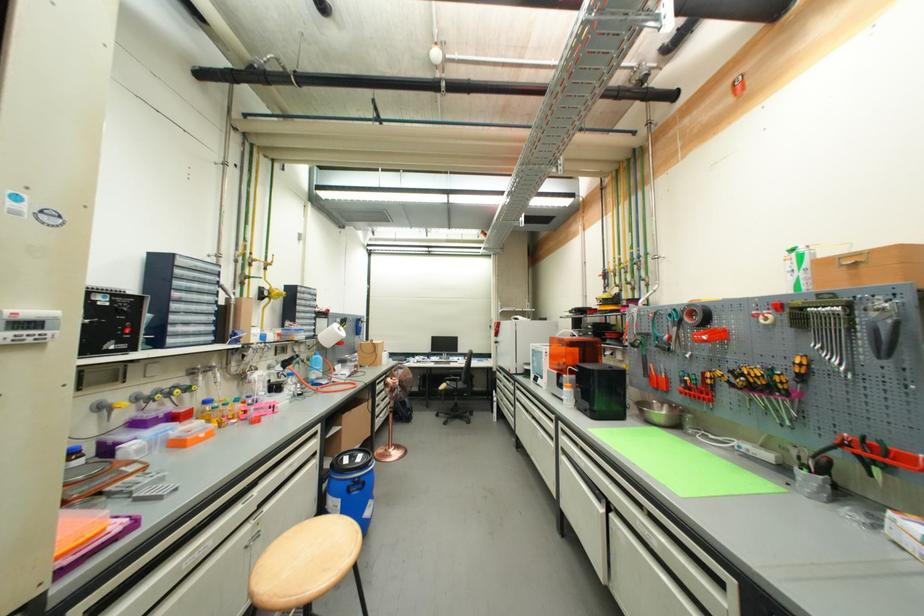
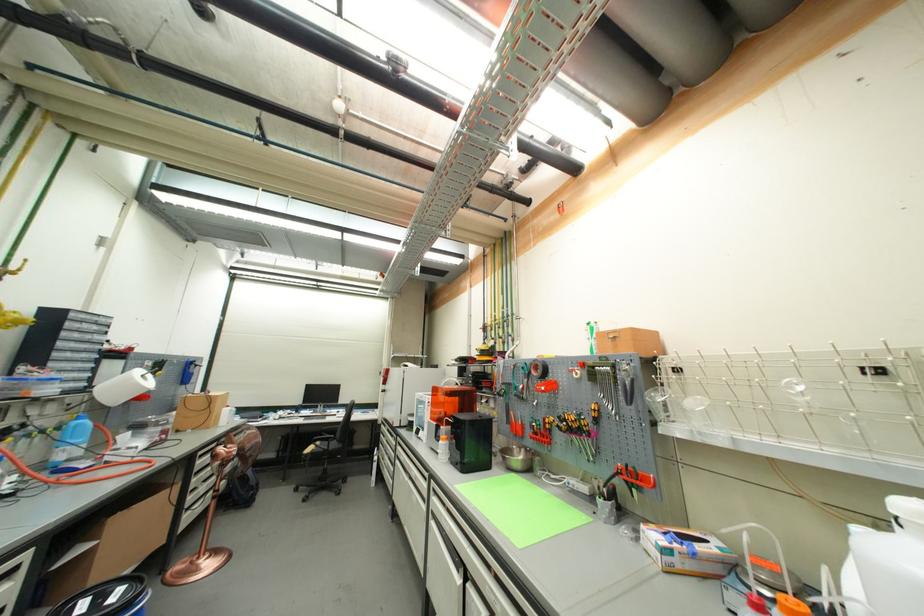
Find the pixel in the second image that matches point 324,339 in the first image.

(103, 391)